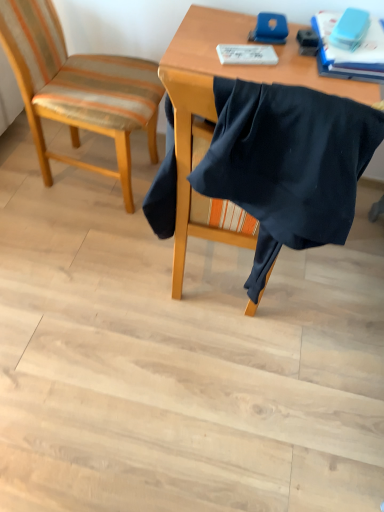
Question: Is striped fabric chair at left, marked as the first chair in a left-to-right arrangement, wider or thinner than blue matte book at upper right?

Choices:
 (A) thin
 (B) wide

Answer: (B)

Question: Is striped fabric chair at left, placed as the 2th chair when sorted from right to left, to the left or to the right of blue matte book at upper right in the image?

Choices:
 (A) right
 (B) left

Answer: (B)

Question: Which is farther from the black fabric at center, the first chair in the right-to-left sequence?

Choices:
 (A) striped fabric chair at left, placed as the 2th chair when sorted from right to left
 (B) blue matte book at upper right
 (C) white paper at upper center

Answer: (A)

Question: Which object is the closest to the blue matte book at upper right?

Choices:
 (A) black fabric at center, acting as the 2th chair starting from the left
 (B) white paper at upper center
 (C) striped fabric chair at left, placed as the 2th chair when sorted from right to left

Answer: (B)